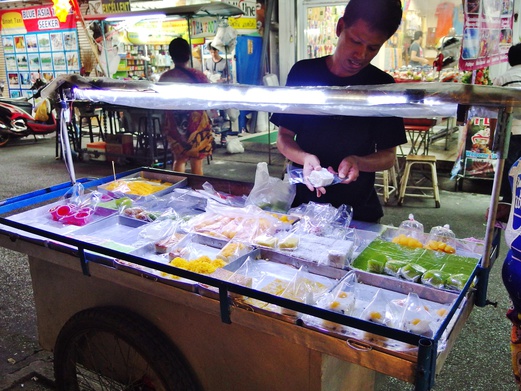
Find the location of `doorway`. doorway is located at coordinates (297, 52).